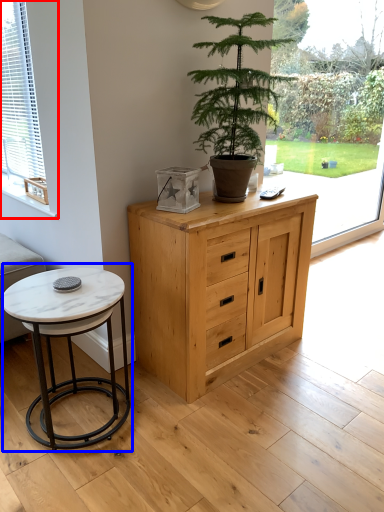
Question: Which object appears closest to the camera in this image, window (highlighted by a red box) or coffee table (highlighted by a blue box)?

Choices:
 (A) window
 (B) coffee table

Answer: (B)